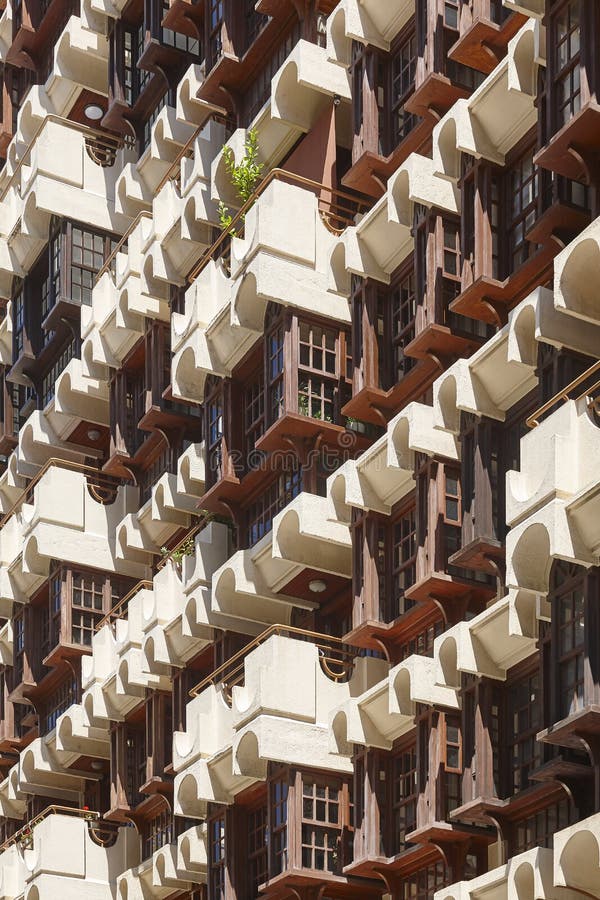
Image resolution: width=600 pixels, height=900 pixels. Find the location of `gray wood`. gray wood is located at coordinates (290, 837), (356, 834), (490, 759), (429, 795), (118, 775), (154, 753), (63, 624), (102, 594), (585, 708), (543, 691).